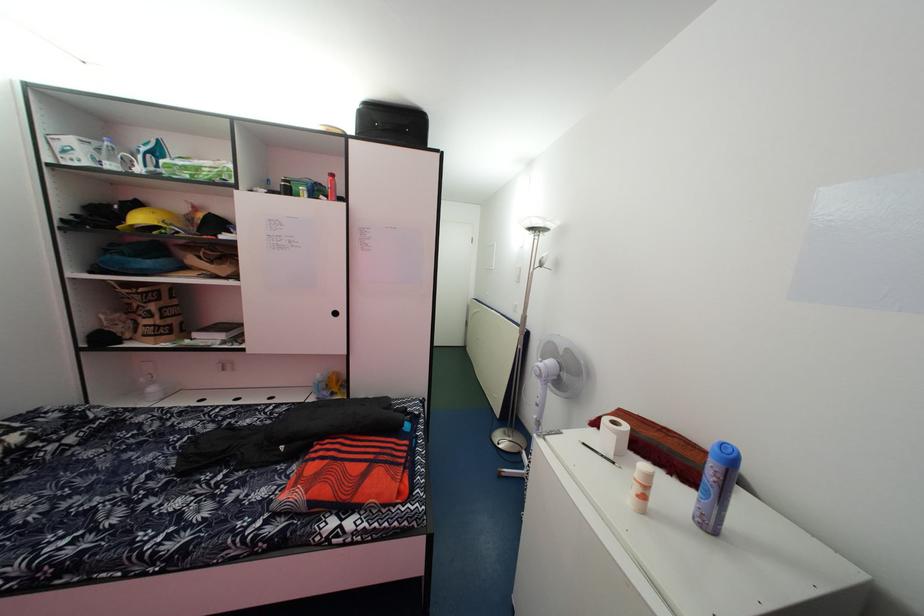
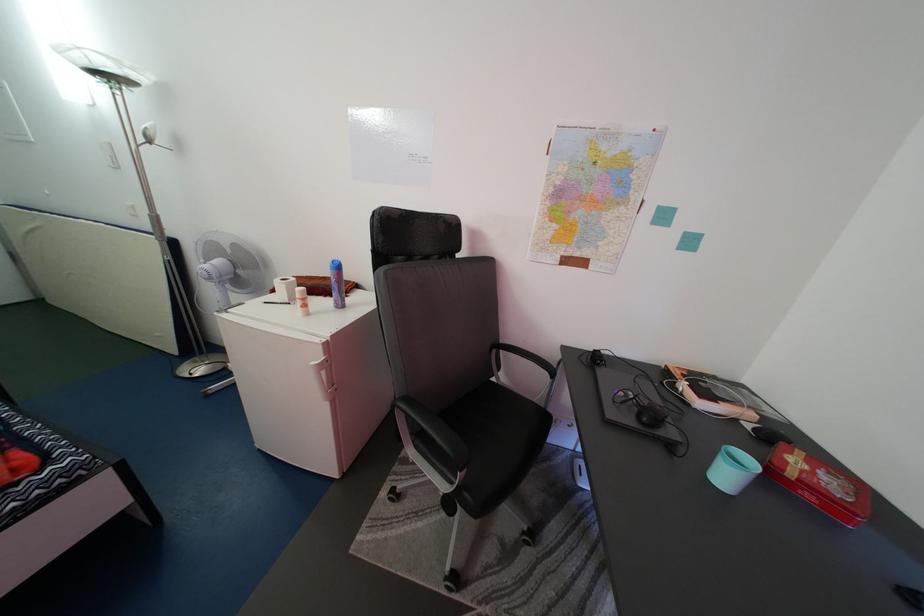
Find the pixel in the second image that matches point 600,442 in the first image.

(280, 304)